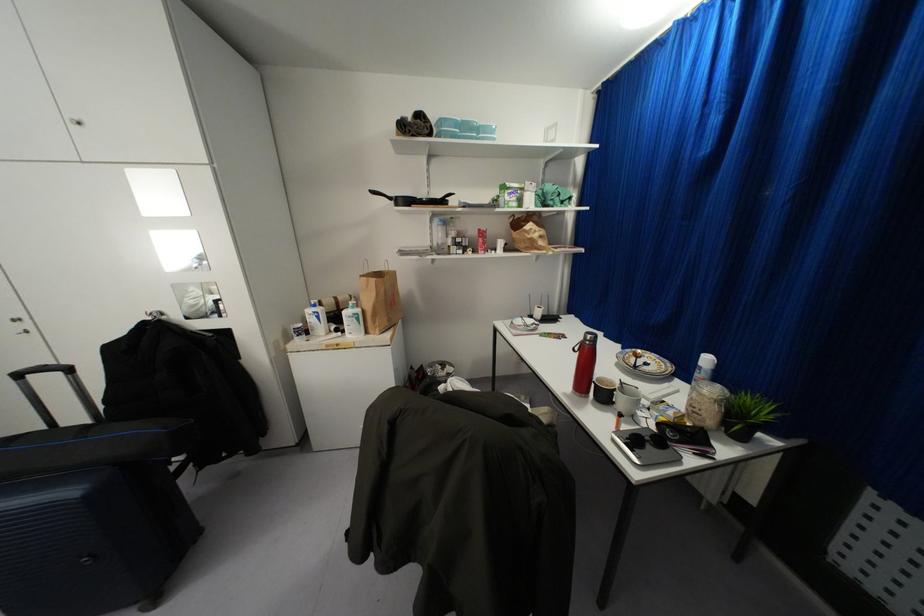
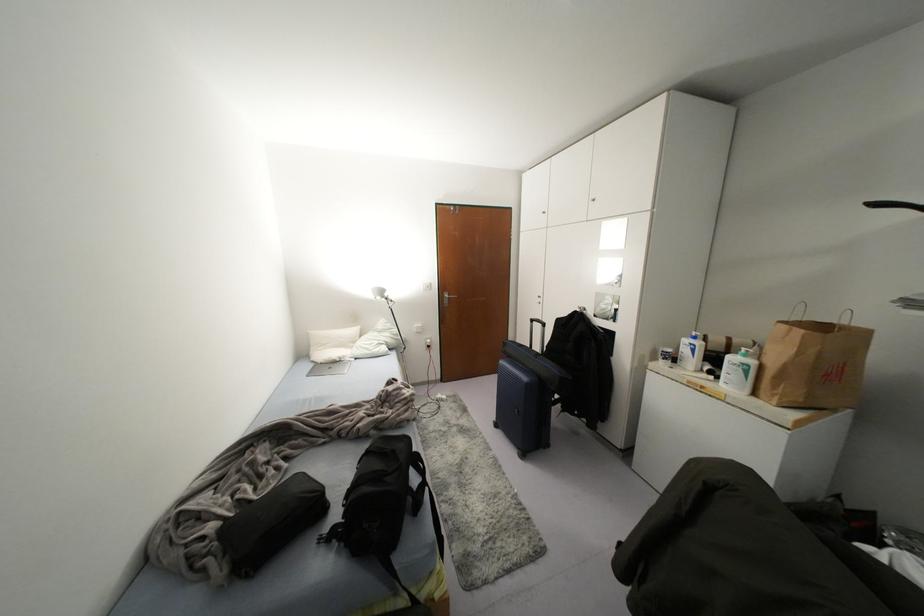
In the second image, find the point that corresponds to point (68, 369) in the first image.

(542, 323)